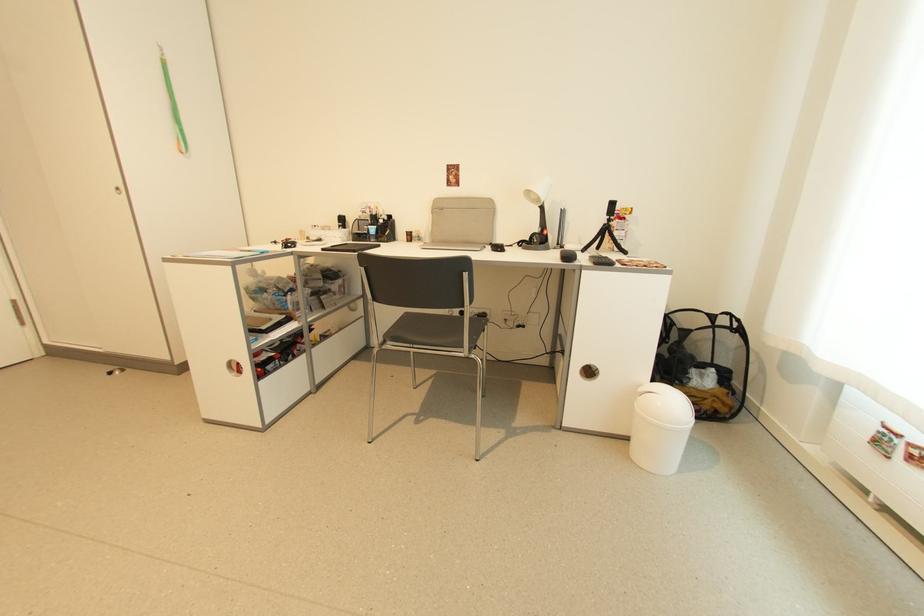
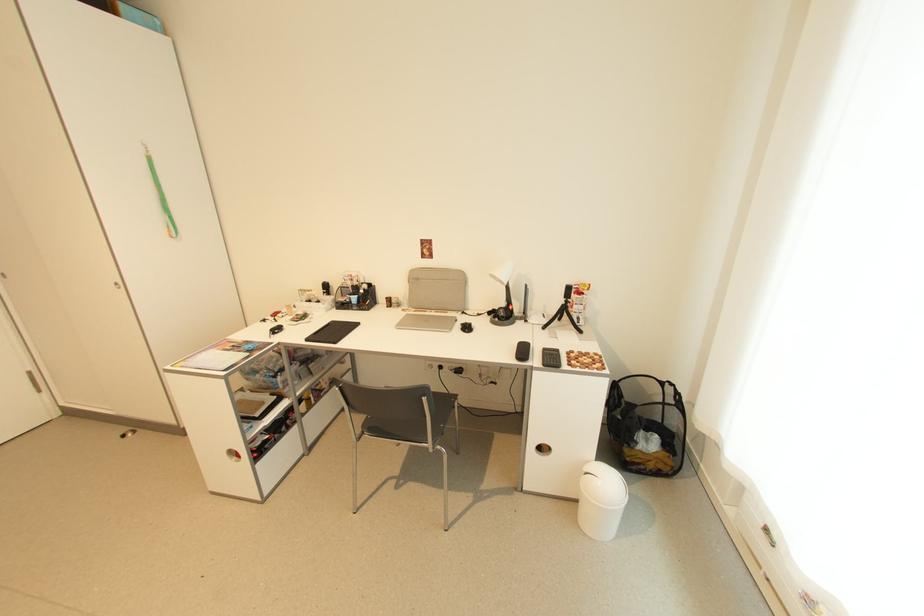
Locate, in the second image, the point that corresponds to the point at 185,146 in the first image.

(175, 233)